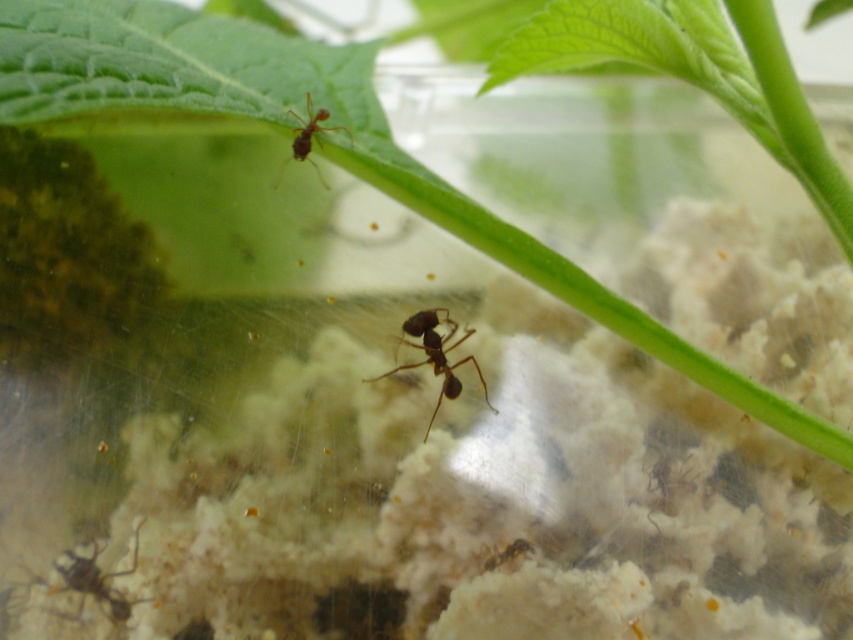
Question: Where is shiny brown ant at center located in relation to brown matte ant at upper center in the image?

Choices:
 (A) left
 (B) right

Answer: (B)

Question: Among these objects, which one is farthest from the camera?

Choices:
 (A) brown matte ant at lower left
 (B) shiny brown ant at center
 (C) brown matte ant at upper center

Answer: (B)

Question: Which point is farther to the camera?

Choices:
 (A) (102, 588)
 (B) (474, 360)

Answer: (B)

Question: Which object appears closest to the camera in this image?

Choices:
 (A) shiny brown ant at center
 (B) brown matte ant at upper center

Answer: (B)

Question: Does shiny brown ant at center lie in front of brown matte ant at upper center?

Choices:
 (A) no
 (B) yes

Answer: (A)

Question: Does shiny brown ant at center appear on the right side of brown matte ant at lower left?

Choices:
 (A) no
 (B) yes

Answer: (B)